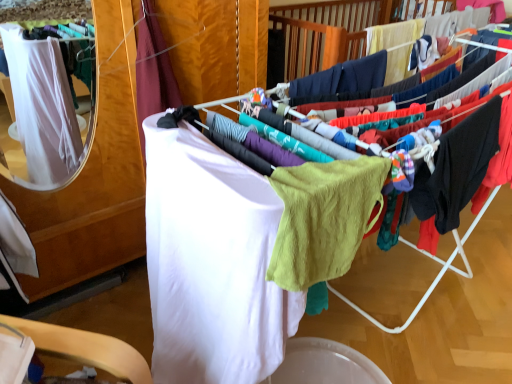
What do you see at coordinates (323, 218) in the screenshot? I see `lime green knit sweater at center` at bounding box center [323, 218].

This screenshot has width=512, height=384. Describe the element at coordinates (212, 263) in the screenshot. I see `white soft towel at center, the second clothing in the right-to-left sequence` at that location.

At what (x,y) coordinates should I click in order to perform the action: click on white fabric at left, the 3th clothing positioned from the right. Please return your answer as a coordinate pair (x, y). Looking at the image, I should click on (153, 70).

The height and width of the screenshot is (384, 512). Find the location of `lime green knit sweater at center`. lime green knit sweater at center is located at coordinates [323, 218].

Which is behind, point (283, 21) or point (442, 151)?

The point (283, 21) is farther.

Identify the location of closet located on the right of black cotton hoodie at right, the 1th clothing in the right-to-left sequence. (330, 29).

Is white fabric at center closer to camera compared to black cotton hoodie at right, the 1th clothing in the right-to-left sequence?

Yes, it is.

Is white fabric at center positioned with its back to black cotton hoodie at right, the 3th clothing in the left-to-right sequence?

Correct, white fabric at center is looking away from black cotton hoodie at right, the 3th clothing in the left-to-right sequence.

Based on their positions, is black cotton hoodie at right, the 3th clothing in the left-to-right sequence, located to the left or right of white soft towel at center, the second clothing in the right-to-left sequence?

black cotton hoodie at right, the 3th clothing in the left-to-right sequence, is to the right of white soft towel at center, the second clothing in the right-to-left sequence.

At what (x,y) coordinates should I click in order to perform the action: click on clothing to the right of white soft towel at center, the second clothing in the left-to-right sequence. Please return your answer as a coordinate pair (x, y). Looking at the image, I should click on (464, 162).

How many degrees apart are the facing directions of black cotton hoodie at right, the 1th clothing in the right-to-left sequence, and white soft towel at center, the second clothing in the right-to-left sequence?

89 degrees separate the facing orientations of black cotton hoodie at right, the 1th clothing in the right-to-left sequence, and white soft towel at center, the second clothing in the right-to-left sequence.

Could you tell me if black cotton hoodie at right, the 3th clothing in the left-to-right sequence, is facing white soft towel at center, the second clothing in the right-to-left sequence?

No, black cotton hoodie at right, the 3th clothing in the left-to-right sequence, is not turned towards white soft towel at center, the second clothing in the right-to-left sequence.

Is lime green knit sweater at center outside of white fabric at left, the 3th clothing positioned from the right?

Yes, lime green knit sweater at center is not within white fabric at left, the 3th clothing positioned from the right.

Which of these two, lime green knit sweater at center or white fabric at left, the first clothing viewed from the left, stands shorter?

lime green knit sweater at center.

Starting from the lime green knit sweater at center, which clothing is the 2nd one behind? Please provide its 2D coordinates.

[(153, 70)]

Is lime green knit sweater at center oriented away from black cotton hoodie at right, the 1th clothing in the right-to-left sequence?

lime green knit sweater at center does not have its back to black cotton hoodie at right, the 1th clothing in the right-to-left sequence.

Where is `the 1st clothing positioned below the lime green knit sweater at center (from a real-world perspective)`? The height and width of the screenshot is (384, 512). the 1st clothing positioned below the lime green knit sweater at center (from a real-world perspective) is located at coordinates (464, 162).

Does lime green knit sweater at center have a greater height compared to black cotton hoodie at right, the 3th clothing in the left-to-right sequence?

In fact, lime green knit sweater at center may be shorter than black cotton hoodie at right, the 3th clothing in the left-to-right sequence.

From the image's perspective, is lime green knit sweater at center above black cotton hoodie at right, the 1th clothing in the right-to-left sequence?

No, from the image's perspective, lime green knit sweater at center is not on top of black cotton hoodie at right, the 1th clothing in the right-to-left sequence.

Does lime green knit sweater at center turn towards white fabric at center?

Yes, lime green knit sweater at center is oriented towards white fabric at center.

Does lime green knit sweater at center have a lesser width compared to white fabric at center?

Yes, lime green knit sweater at center is thinner than white fabric at center.

You are a GUI agent. You are given a task and a screenshot of the screen. Output one action in this format:
    pyautogui.click(x=<x>, y=<y>)
    Task: Click on the baby clothe lying behind the white fabric at center
    
    Given the screenshot: What is the action you would take?
    pyautogui.click(x=323, y=218)

Consider the image. From the image's perspective, is lime green knit sweater at center above or below white fabric at center?

Based on their image positions, lime green knit sweater at center is located beneath white fabric at center.

From a real-world perspective, does white fabric at center stand above white fabric at left, the 3th clothing positioned from the right?

No, from a real-world perspective, white fabric at center is not over white fabric at left, the 3th clothing positioned from the right

Is white fabric at center outside of white fabric at left, the first clothing viewed from the left?

white fabric at center is positioned outside white fabric at left, the first clothing viewed from the left.

Is white fabric at center taller or shorter than white fabric at left, the first clothing viewed from the left?

Considering their sizes, white fabric at center has more height than white fabric at left, the first clothing viewed from the left.

Is white fabric at center to the left or to the right of white fabric at left, the 3th clothing positioned from the right, in the image?

Clearly, white fabric at center is on the right of white fabric at left, the 3th clothing positioned from the right, in the image.

Does white soft towel at center, the second clothing in the left-to-right sequence, come behind white fabric at center?

No, it is not.

Is white soft towel at center, the second clothing in the left-to-right sequence, smaller than white fabric at center?

Indeed, white soft towel at center, the second clothing in the left-to-right sequence, has a smaller size compared to white fabric at center.

Is white soft towel at center, the second clothing in the right-to-left sequence, spatially inside white fabric at center, or outside of it?

white soft towel at center, the second clothing in the right-to-left sequence, is inside white fabric at center.

From the image's perspective, is white soft towel at center, the second clothing in the right-to-left sequence, under white fabric at center?

Yes, from the image's perspective, white soft towel at center, the second clothing in the right-to-left sequence, is beneath white fabric at center.

The image size is (512, 384). I want to click on closet lying in front of the black cotton hoodie at right, the 1th clothing in the right-to-left sequence, so click(x=330, y=29).

From the image's perspective, count 1st clothings upward from the white soft towel at center, the second clothing in the right-to-left sequence, and point to it. Please provide its 2D coordinates.

[(464, 162)]

Looking at the image, which one is located closer to white fabric at center, lime green knit sweater at center or white fabric at left, the first clothing viewed from the left?

Among the two, white fabric at left, the first clothing viewed from the left, is located nearer to white fabric at center.

From the image, which object appears to be nearer to white soft towel at center, the second clothing in the right-to-left sequence, white fabric at left, the first clothing viewed from the left, or white fabric at center?

Among the two, white fabric at left, the first clothing viewed from the left, is located nearer to white soft towel at center, the second clothing in the right-to-left sequence.

In the scene shown: When comparing their distances from white fabric at left, the 3th clothing positioned from the right, does lime green knit sweater at center or black cotton hoodie at right, the 1th clothing in the right-to-left sequence, seem closer?

Among the two, lime green knit sweater at center is located nearer to white fabric at left, the 3th clothing positioned from the right.

Based on their spatial positions, is lime green knit sweater at center or black cotton hoodie at right, the 1th clothing in the right-to-left sequence, further from white fabric at center?

Among the two, lime green knit sweater at center is located further to white fabric at center.

Considering their positions, is white soft towel at center, the second clothing in the right-to-left sequence, positioned closer to white fabric at left, the first clothing viewed from the left, than black cotton hoodie at right, the 1th clothing in the right-to-left sequence?

Among the two, white soft towel at center, the second clothing in the right-to-left sequence, is located nearer to white fabric at left, the first clothing viewed from the left.

Looking at the image, which one is located closer to white soft towel at center, the second clothing in the right-to-left sequence, black cotton hoodie at right, the 1th clothing in the right-to-left sequence, or white fabric at left, the 3th clothing positioned from the right?

black cotton hoodie at right, the 1th clothing in the right-to-left sequence, lies closer to white soft towel at center, the second clothing in the right-to-left sequence, than the other object.

Considering their positions, is black cotton hoodie at right, the 1th clothing in the right-to-left sequence, positioned further to lime green knit sweater at center than white soft towel at center, the second clothing in the left-to-right sequence?

black cotton hoodie at right, the 1th clothing in the right-to-left sequence, lies further to lime green knit sweater at center than the other object.

Which object lies further to the anchor point black cotton hoodie at right, the 1th clothing in the right-to-left sequence, white soft towel at center, the second clothing in the right-to-left sequence, or white fabric at center?

Among the two, white fabric at center is located further to black cotton hoodie at right, the 1th clothing in the right-to-left sequence.

The image size is (512, 384). I want to click on baby clothe between white soft towel at center, the second clothing in the left-to-right sequence, and white fabric at left, the 3th clothing positioned from the right, from front to back, so click(323, 218).

Find the location of `clothing between white fabric at left, the 3th clothing positioned from the right, and black cotton hoodie at right, the 1th clothing in the right-to-left sequence, in the horizontal direction`. clothing between white fabric at left, the 3th clothing positioned from the right, and black cotton hoodie at right, the 1th clothing in the right-to-left sequence, in the horizontal direction is located at coordinates (212, 263).

Find the location of a particular element. Image resolution: width=512 pixels, height=384 pixels. baby clothe between white soft towel at center, the second clothing in the right-to-left sequence, and black cotton hoodie at right, the 3th clothing in the left-to-right sequence is located at coordinates (323, 218).

This screenshot has height=384, width=512. I want to click on baby clothe situated between white soft towel at center, the second clothing in the left-to-right sequence, and white fabric at center from left to right, so click(x=323, y=218).